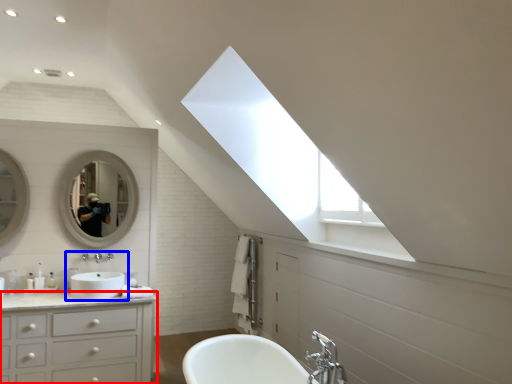
Question: Which point is further to the camera, bathroom cabinet (highlighted by a red box) or sink (highlighted by a blue box)?

Choices:
 (A) bathroom cabinet
 (B) sink

Answer: (B)